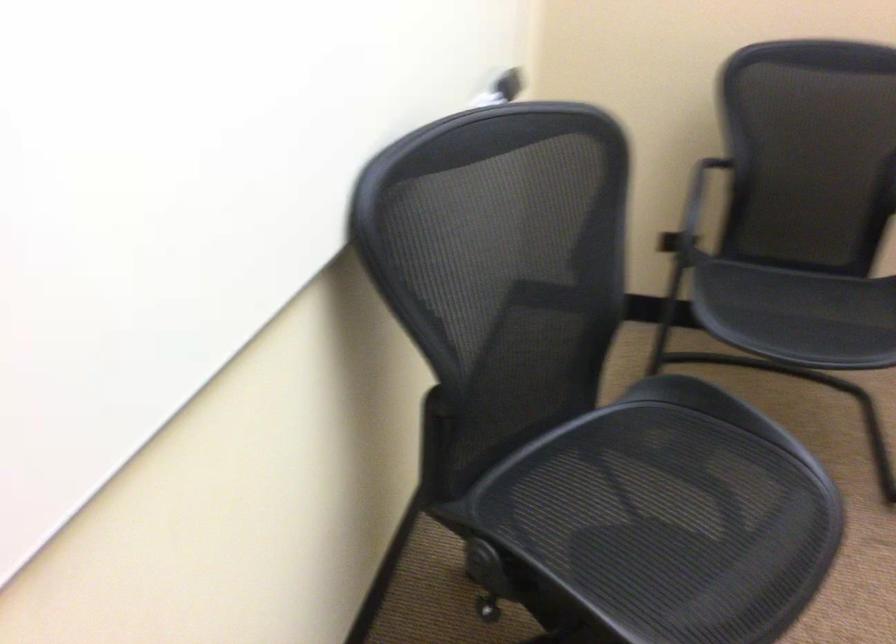
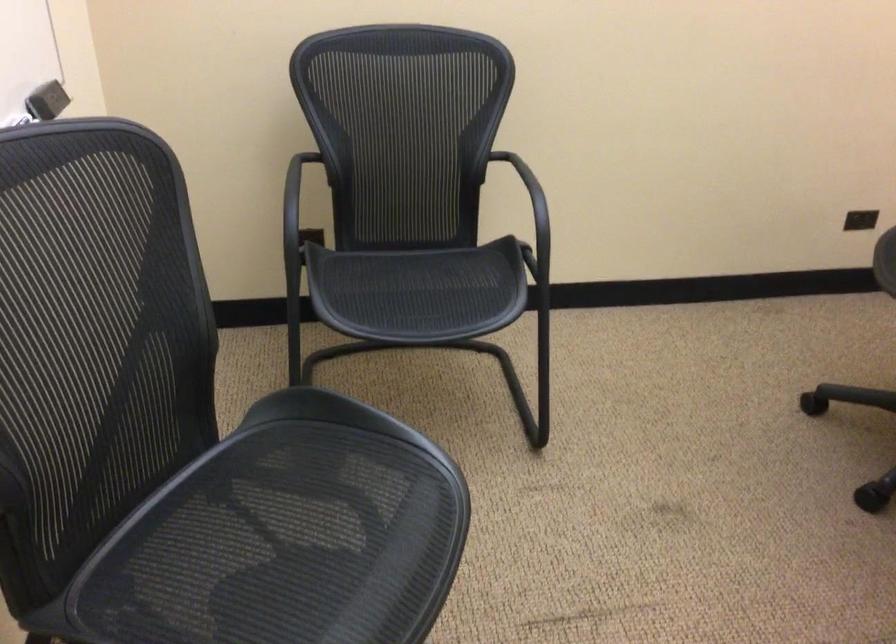
Find the pixel in the second image that matches the point at 634,509 in the first image.

(259, 547)